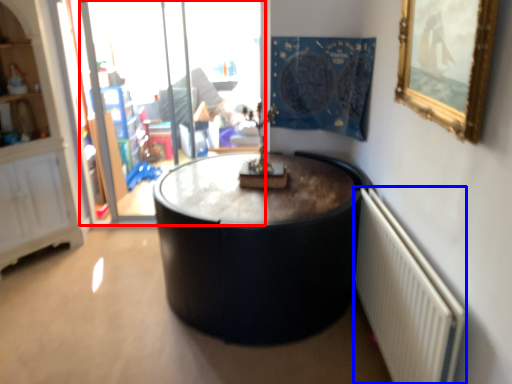
Question: Which object appears farthest to the camera in this image, glass door (highlighted by a red box) or radiator (highlighted by a blue box)?

Choices:
 (A) glass door
 (B) radiator

Answer: (A)